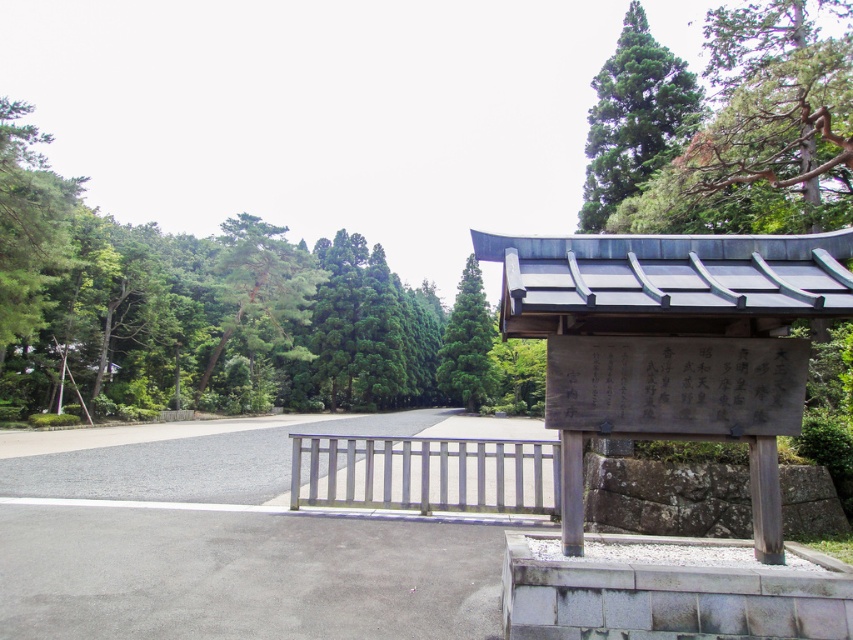
Question: Is white stone plaque at center behind green matte tree at center?

Choices:
 (A) yes
 (B) no

Answer: (B)

Question: Which object is farther from the camera taking this photo?

Choices:
 (A) white stone plaque at center
 (B) white painted wood rail at center
 (C) green matte tree at center

Answer: (C)

Question: Is white painted wood rail at center behind green coniferous tree at upper center?

Choices:
 (A) no
 (B) yes

Answer: (A)

Question: Which point is farther to the camera?

Choices:
 (A) green leafy trees at left
 (B) green textured tree at upper right

Answer: (A)

Question: Can you confirm if green leafy trees at left is positioned to the right of green matte tree at center?

Choices:
 (A) no
 (B) yes

Answer: (A)

Question: Which of the following is the farthest from the observer?

Choices:
 (A) green leafy trees at left
 (B) white stone plaque at center
 (C) green matte tree at center
 (D) green coniferous tree at upper center

Answer: (C)